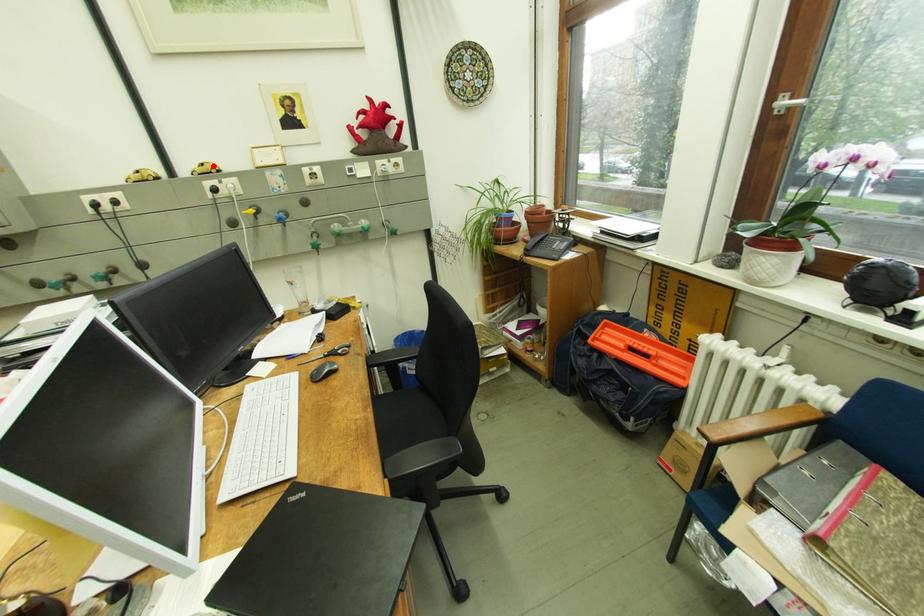
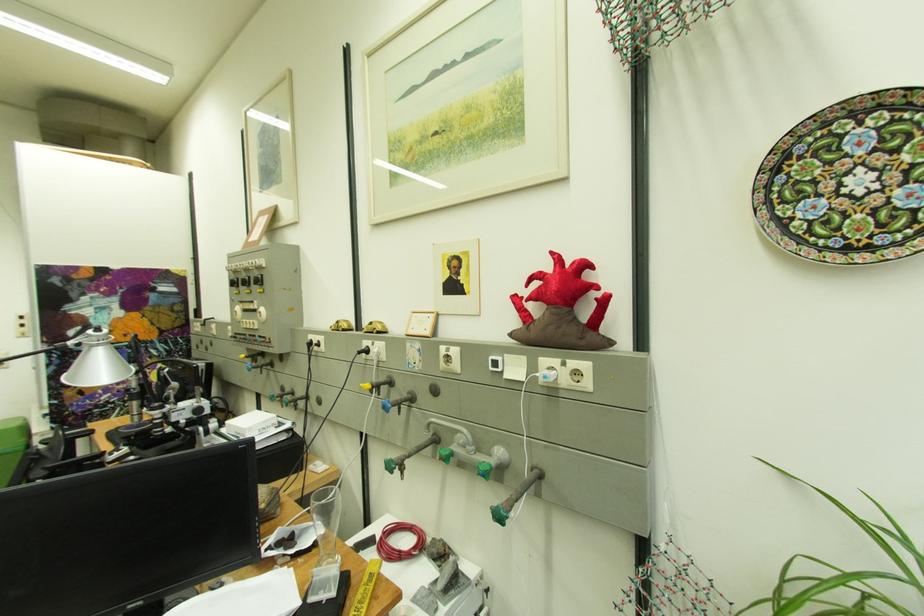
In the second image, find the point that corresponds to the highlighted location in the first image.

(382, 323)